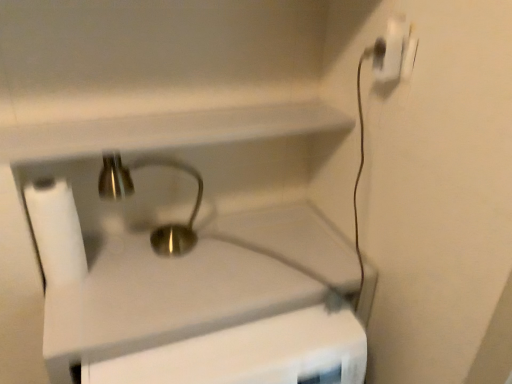
What is the approximate height of white plastic power plug at upper right?

The height of white plastic power plug at upper right is 9.30 centimeters.

I want to click on white matte toilet paper at left, so click(x=56, y=231).

From a real-world perspective, which object rests below the other?

polished brass faucet at center is physically lower.

Is white plastic power plug at upper right closer to the viewer compared to polished brass faucet at center?

Yes, it is in front of polished brass faucet at center.

Would you say white plastic power plug at upper right is to the left or to the right of polished brass faucet at center in the picture?

white plastic power plug at upper right is to the right of polished brass faucet at center.

Which is farther from the camera, [377,59] or [124,192]?

The point [124,192] is more distant.

The height and width of the screenshot is (384, 512). What are the coordinates of `faucet lying on the right of white matte toilet paper at left` in the screenshot? It's located at pyautogui.click(x=133, y=193).

In the image, is polished brass faucet at center on the left side or the right side of white matte toilet paper at left?

In the image, polished brass faucet at center appears on the right side of white matte toilet paper at left.

Is polished brass faucet at center aimed at white matte toilet paper at left?

No, polished brass faucet at center is not aimed at white matte toilet paper at left.

Is brass metallic sink at center beside white matte toilet paper at left?

brass metallic sink at center and white matte toilet paper at left are clearly separated.

Could you tell me if brass metallic sink at center is facing white matte toilet paper at left?

No, brass metallic sink at center is not oriented towards white matte toilet paper at left.

Does brass metallic sink at center appear on the left side of white matte toilet paper at left?

Incorrect, brass metallic sink at center is not on the left side of white matte toilet paper at left.

From the image's perspective, which object appears higher, brass metallic sink at center or white matte toilet paper at left?

white matte toilet paper at left is shown above in the image.

How far apart are brass metallic sink at center and white plastic power plug at upper right?

The distance of brass metallic sink at center from white plastic power plug at upper right is 25.33 inches.

Considering the relative sizes of brass metallic sink at center and white plastic power plug at upper right in the image provided, is brass metallic sink at center shorter than white plastic power plug at upper right?

Incorrect, the height of brass metallic sink at center does not fall short of that of white plastic power plug at upper right.

Locate an element on the screen. The width and height of the screenshot is (512, 384). sink below the white plastic power plug at upper right (from the image's perspective) is located at coordinates (157, 283).

Is point (165, 314) positioned in front of point (404, 24)?

No.

From the image's perspective, is white matte toilet paper at left on white plastic power plug at upper right?

No, from the image's perspective, white matte toilet paper at left is not over white plastic power plug at upper right.

Identify the location of power plugs and sockets that appears in front of the white matte toilet paper at left. This screenshot has height=384, width=512. (395, 52).

Could you tell me if white matte toilet paper at left is turned towards white plastic power plug at upper right?

No, white matte toilet paper at left is not oriented towards white plastic power plug at upper right.

From the image's perspective, which one is positioned lower, white matte toilet paper at left or polished brass faucet at center?

From the image's view, white matte toilet paper at left is below.

Is there a large distance between white matte toilet paper at left and polished brass faucet at center?

Actually, white matte toilet paper at left and polished brass faucet at center are a little close together.

Between white matte toilet paper at left and polished brass faucet at center, which one has smaller size?

Smaller between the two is white matte toilet paper at left.

Can you tell me how much white matte toilet paper at left and polished brass faucet at center differ in facing direction?

The facing directions of white matte toilet paper at left and polished brass faucet at center are 0.286 degrees apart.

Which is correct: polished brass faucet at center is inside brass metallic sink at center, or outside of it?

The correct answer is: outside.

Between polished brass faucet at center and brass metallic sink at center, which one has more height?

brass metallic sink at center.

Which object is positioned more to the right, polished brass faucet at center or brass metallic sink at center?

From the viewer's perspective, brass metallic sink at center appears more on the right side.

Can you confirm if polished brass faucet at center is thinner than brass metallic sink at center?

Indeed, polished brass faucet at center has a lesser width compared to brass metallic sink at center.

In the image, there is a polished brass faucet at center. At what (x,y) coordinates should I click in order to perform the action: click on power plugs and sockets above it (from the image's perspective). Please return your answer as a coordinate pair (x, y). Looking at the image, I should click on (395, 52).

Where is `toilet paper that is on the left side of polished brass faucet at center`? Image resolution: width=512 pixels, height=384 pixels. toilet paper that is on the left side of polished brass faucet at center is located at coordinates (56, 231).

Looking at this image, when comparing their distances from polished brass faucet at center, does white matte toilet paper at left or white plastic power plug at upper right seem further?

Among the two, white plastic power plug at upper right is located further to polished brass faucet at center.

Which object lies further to the anchor point polished brass faucet at center, brass metallic sink at center or white matte toilet paper at left?

white matte toilet paper at left.

When comparing their distances from white matte toilet paper at left, does white plastic power plug at upper right or polished brass faucet at center seem closer?

polished brass faucet at center is closer to white matte toilet paper at left.

Considering their positions, is brass metallic sink at center positioned closer to white matte toilet paper at left than white plastic power plug at upper right?

brass metallic sink at center lies closer to white matte toilet paper at left than the other object.

From the image, which object appears to be nearer to brass metallic sink at center, white matte toilet paper at left or white plastic power plug at upper right?

Based on the image, white matte toilet paper at left appears to be nearer to brass metallic sink at center.

Which object lies nearer to the anchor point polished brass faucet at center, white plastic power plug at upper right or brass metallic sink at center?

The object closer to polished brass faucet at center is brass metallic sink at center.

Considering their positions, is brass metallic sink at center positioned closer to white plastic power plug at upper right than white matte toilet paper at left?

Among the two, brass metallic sink at center is located nearer to white plastic power plug at upper right.

Looking at the image, which one is located further to white plastic power plug at upper right, polished brass faucet at center or white matte toilet paper at left?

white matte toilet paper at left is positioned further to the anchor white plastic power plug at upper right.

Where is `faucet between white plastic power plug at upper right and brass metallic sink at center from top to bottom`? faucet between white plastic power plug at upper right and brass metallic sink at center from top to bottom is located at coordinates (133, 193).

Image resolution: width=512 pixels, height=384 pixels. What are the coordinates of `sink between white matte toilet paper at left and white plastic power plug at upper right in the horizontal direction` in the screenshot? It's located at (157, 283).

Image resolution: width=512 pixels, height=384 pixels. In order to click on toilet paper between polished brass faucet at center and brass metallic sink at center vertically in this screenshot , I will do `click(56, 231)`.

Find the location of a particular element. faucet between white matte toilet paper at left and white plastic power plug at upper right in the horizontal direction is located at coordinates tap(133, 193).